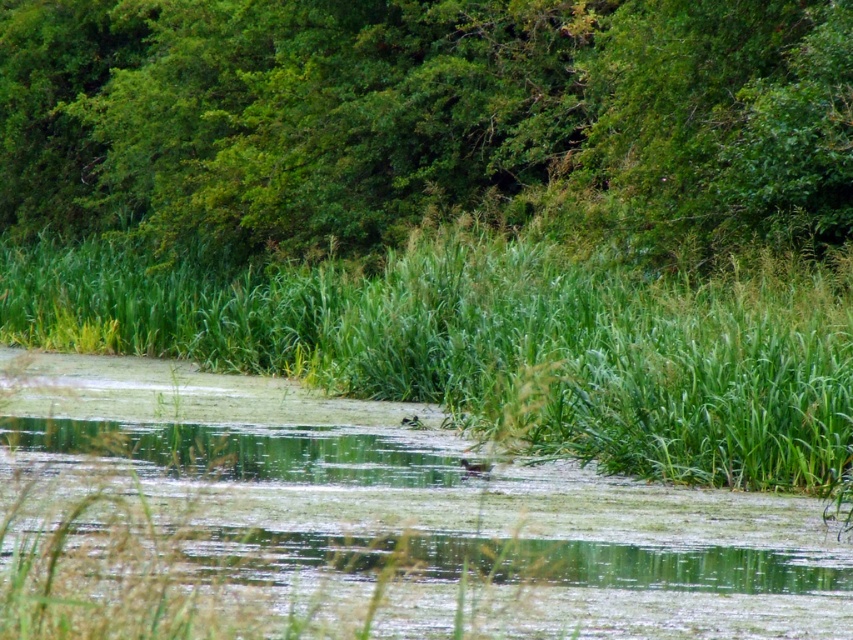
Consider the image. Who is positioned more to the right, green leafy trees at upper center or green grass at center?

From the viewer's perspective, green leafy trees at upper center appears more on the right side.

Can you confirm if green leafy trees at upper center is bigger than green grass at center?

Yes, green leafy trees at upper center is bigger than green grass at center.

Find the location of a particular element. green leafy trees at upper center is located at coordinates (427, 120).

This screenshot has height=640, width=853. In order to click on green leafy trees at upper center in this screenshot , I will do `click(427, 120)`.